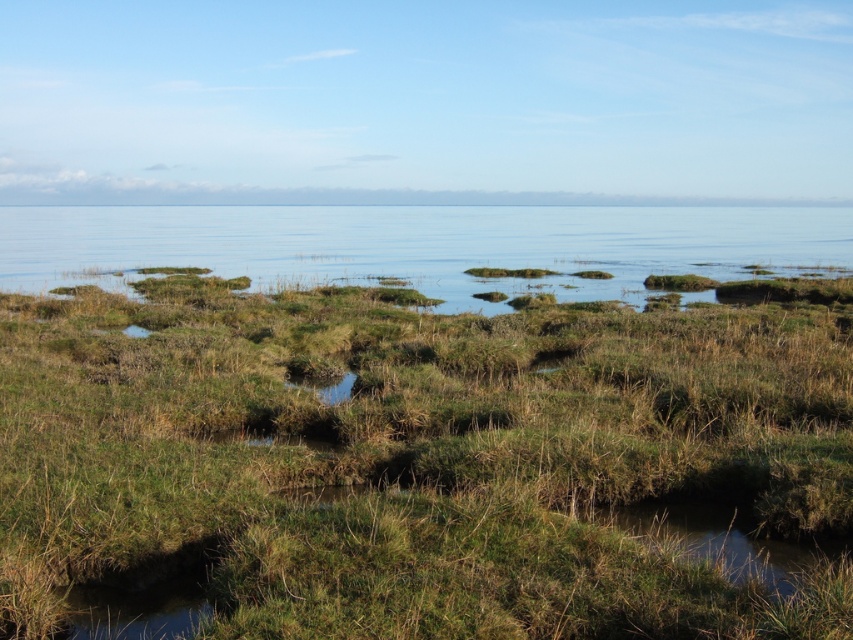
Is green grassy at center positioned before clear blue water at center?

Yes, it is in front of clear blue water at center.

Is green grassy at center wider than clear blue water at center?

No.

Find the location of `green grassy at center`. green grassy at center is located at coordinates (416, 460).

Identify the location of green grassy at center. This screenshot has width=853, height=640. (416, 460).